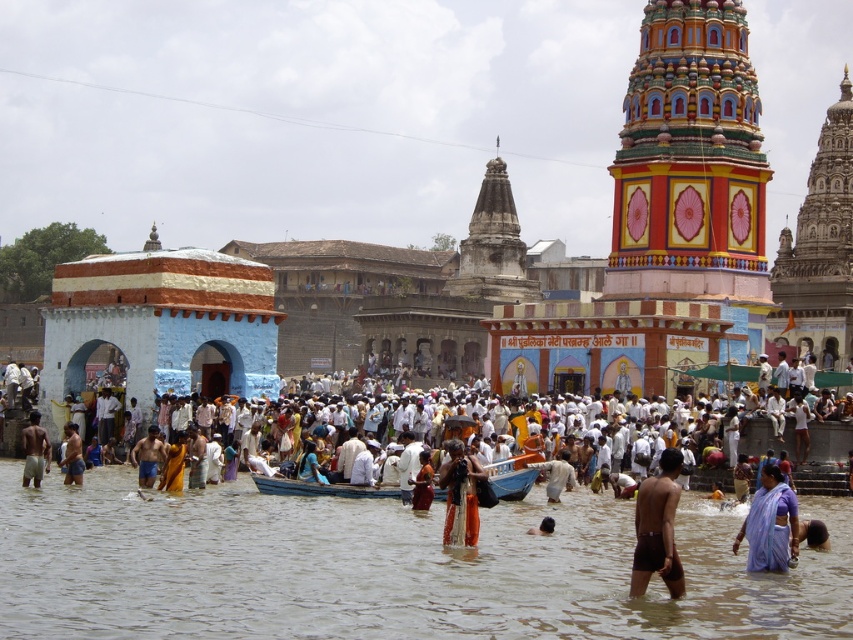
This screenshot has width=853, height=640. Identify the location of orange fabric cloth at center. (460, 493).

Is orange fabric cloth at center below brown skin at lower center?

Actually, orange fabric cloth at center is above brown skin at lower center.

This screenshot has width=853, height=640. What do you see at coordinates (460, 493) in the screenshot?
I see `orange fabric cloth at center` at bounding box center [460, 493].

Find the location of `orange fabric cloth at center`. orange fabric cloth at center is located at coordinates tap(460, 493).

Can you confirm if orange fabric cloth at lower left is positioned below brown skin at lower center?

No.

Does orange fabric cloth at lower left have a smaller size compared to brown skin at lower center?

Incorrect, orange fabric cloth at lower left is not smaller in size than brown skin at lower center.

Between point (80, 481) and point (537, 532), which one is positioned behind?

The point (80, 481) is behind.

Find the location of a particular element. orange fabric cloth at lower left is located at coordinates (73, 456).

Image resolution: width=853 pixels, height=640 pixels. Describe the element at coordinates (318, 488) in the screenshot. I see `blue wooden boat at center` at that location.

Locate an element on the screen. The width and height of the screenshot is (853, 640). blue wooden boat at center is located at coordinates (318, 488).

Image resolution: width=853 pixels, height=640 pixels. Identify the location of blue wooden boat at center. (318, 488).